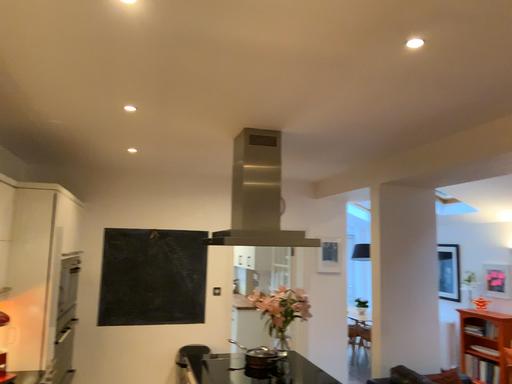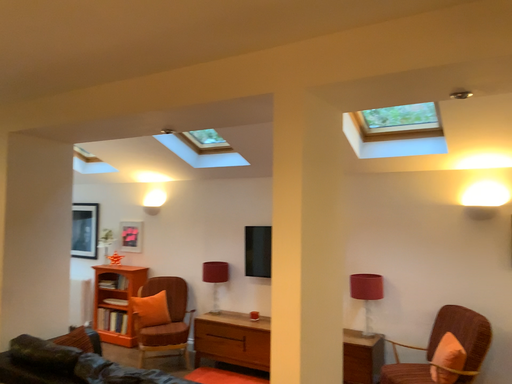
Question: Which way did the camera rotate in the video?

Choices:
 (A) rotated left
 (B) rotated right

Answer: (B)